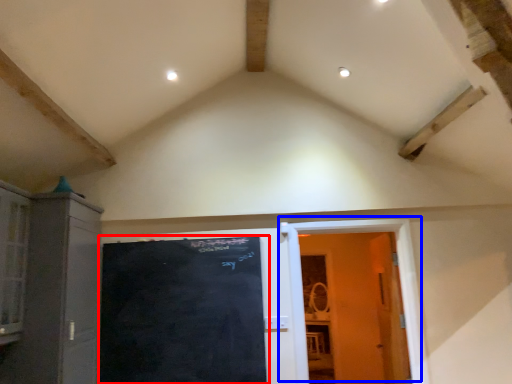
Question: Which point is closer to the camera, bulletin board (highlighted by a red box) or door (highlighted by a blue box)?

Choices:
 (A) bulletin board
 (B) door

Answer: (A)